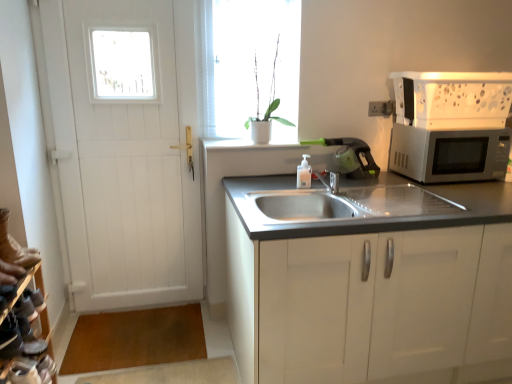
Question: From a real-world perspective, relative to leather shoe at lower left, is white smooth window sill at upper center vertically above or below?

Choices:
 (A) above
 (B) below

Answer: (A)

Question: Is white smooth window sill at upper center taller or shorter than leather shoe at lower left?

Choices:
 (A) tall
 (B) short

Answer: (B)

Question: Estimate the real-world distances between objects in this image. Which object is closer to the white matte plant at upper center?

Choices:
 (A) silver metallic microwave at right
 (B) white wooden door at left
 (C) leather shoe at lower left
 (D) leather shoe rack at lower left
 (E) white matte cabinet at center

Answer: (B)

Question: Which is nearer to the white matte cabinet at center?

Choices:
 (A) white matte pot at upper center
 (B) silver metallic microwave at right
 (C) leather shoe at lower left
 (D) white matte plant at upper center
 (E) white smooth window sill at upper center

Answer: (B)